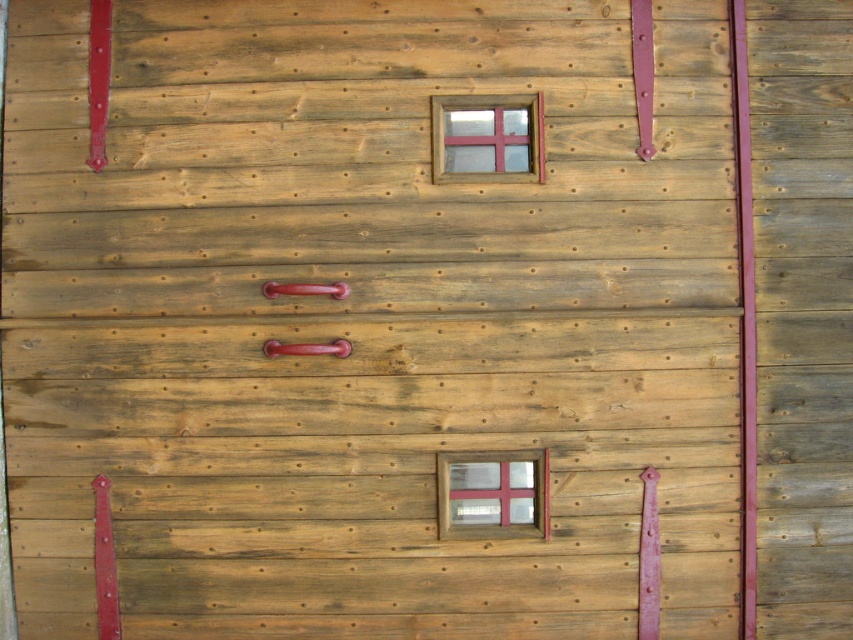
Question: Which object is farther from the camera taking this photo?

Choices:
 (A) matte wooden window at upper center
 (B) shiny red metal handle at center

Answer: (A)

Question: Observing the image, what is the correct spatial positioning of glossy metal handle at center in reference to shiny red metal handle at center?

Choices:
 (A) right
 (B) left

Answer: (B)

Question: Which point is closer to the camera taking this photo?

Choices:
 (A) (445, 483)
 (B) (292, 288)
 (C) (331, 348)

Answer: (B)

Question: Can you confirm if matte wooden window at upper center is wider than glossy metal handle at center?

Choices:
 (A) yes
 (B) no

Answer: (A)

Question: Observing the image, what is the correct spatial positioning of matte wooden window at upper center in reference to glossy metal handle at center?

Choices:
 (A) right
 (B) left

Answer: (A)

Question: Which point is farther to the camera?

Choices:
 (A) shiny red metal handle at center
 (B) matte wooden window at upper center
 (C) wooden frame window at center

Answer: (C)